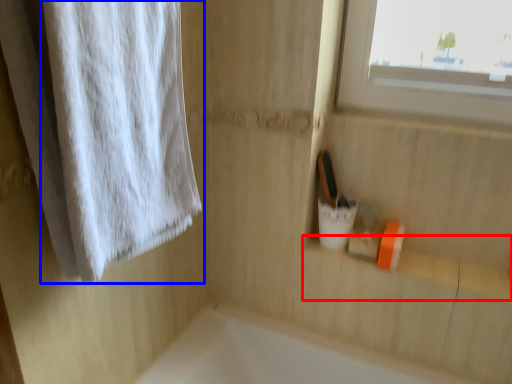
Question: Which of the following is the closest to the observer, window sill (highlighted by a red box) or curtain (highlighted by a blue box)?

Choices:
 (A) window sill
 (B) curtain

Answer: (B)